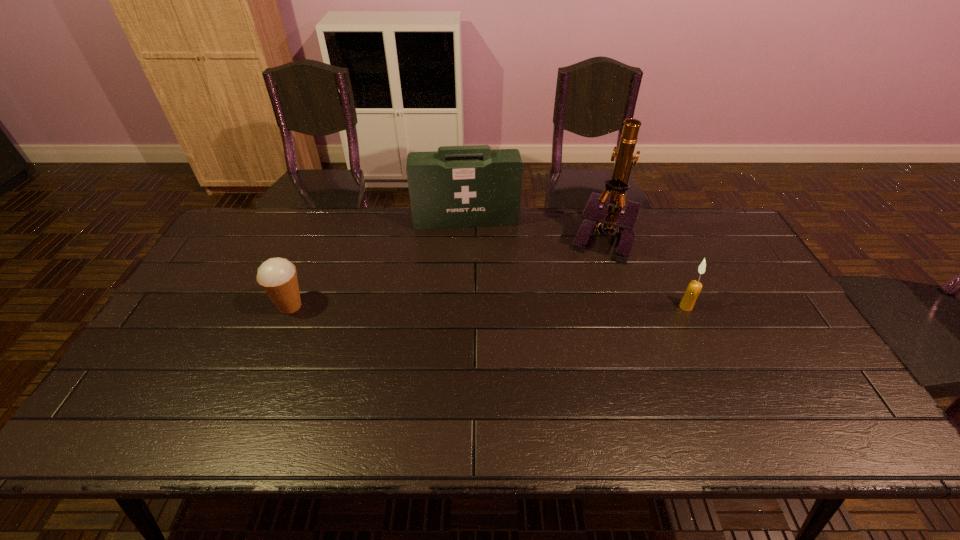
The width and height of the screenshot is (960, 540). I want to click on the leftmost object, so tap(277, 276).

The height and width of the screenshot is (540, 960). I want to click on candle, so click(x=693, y=290).

In order to click on the third object from right to left in this screenshot , I will do `click(469, 190)`.

Locate an element on the screen. the second tallest object is located at coordinates (469, 190).

Where is `the tallest object`? The width and height of the screenshot is (960, 540). the tallest object is located at coordinates (619, 219).

Locate an element on the screen. The height and width of the screenshot is (540, 960). microscope is located at coordinates tap(619, 219).

Where is `vacant space located 0.300m on the right of the icecream`? vacant space located 0.300m on the right of the icecream is located at coordinates (413, 306).

Locate an element on the screen. Image resolution: width=960 pixels, height=540 pixels. free spot located on the left of the rightmost object is located at coordinates (648, 307).

Locate an element on the screen. vacant position located on the front-facing side of the third shortest object is located at coordinates (x=475, y=308).

You are a GUI agent. You are given a task and a screenshot of the screen. Output one action in this format:
    pyautogui.click(x=<x>, y=<y>)
    Task: Click on the free space located on the front-facing side of the third shortest object
    
    Given the screenshot: What is the action you would take?
    pyautogui.click(x=474, y=293)